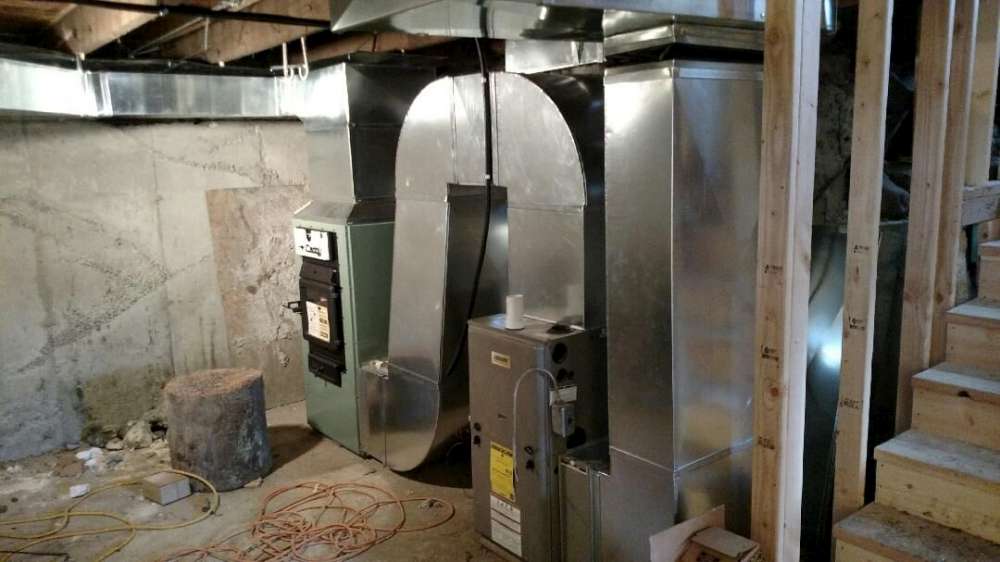
At what (x,y) coordinates should I click in order to perform the action: click on vent system. Please return your answer as a coordinate pair (x, y). This screenshot has width=1000, height=562. Looking at the image, I should click on (693, 176), (615, 516), (588, 197), (465, 110), (420, 427), (345, 113), (115, 101).